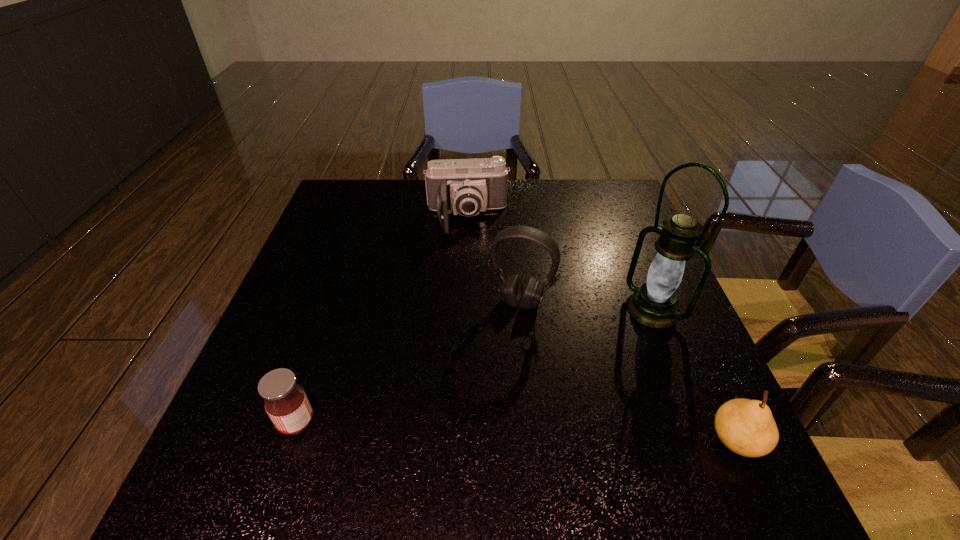
This screenshot has width=960, height=540. Identify the location of the leftmost object. pyautogui.click(x=286, y=403).

Image resolution: width=960 pixels, height=540 pixels. In order to click on pear in this screenshot , I will do `click(747, 427)`.

I want to click on headset, so click(511, 290).

Locate an element on the screen. camera is located at coordinates (461, 186).

You are a GUI agent. You are given a task and a screenshot of the screen. Output one action in this format:
    pyautogui.click(x=<x>, y=<y>)
    Task: Click on the tallest object
    
    Given the screenshot: What is the action you would take?
    pyautogui.click(x=654, y=304)

Where is `vacant space positioned 0.060m on the label side of the leftmost object`? Image resolution: width=960 pixels, height=540 pixels. vacant space positioned 0.060m on the label side of the leftmost object is located at coordinates (245, 422).

The width and height of the screenshot is (960, 540). Find the location of `free spot located 0.130m on the back of the pear`. free spot located 0.130m on the back of the pear is located at coordinates (700, 359).

At what (x,y) coordinates should I click in order to perform the action: click on free space located 0.270m on the front-facing side of the fourth shortest object. Please return your answer as a coordinate pair (x, y). Looking at the image, I should click on (472, 416).

Image resolution: width=960 pixels, height=540 pixels. What are the coordinates of `vacant region located on the front-facing side of the fourth shortest object` in the screenshot? It's located at (462, 445).

Locate an element on the screen. This screenshot has height=540, width=960. vacant space located 0.300m on the front-facing side of the fourth shortest object is located at coordinates (468, 430).